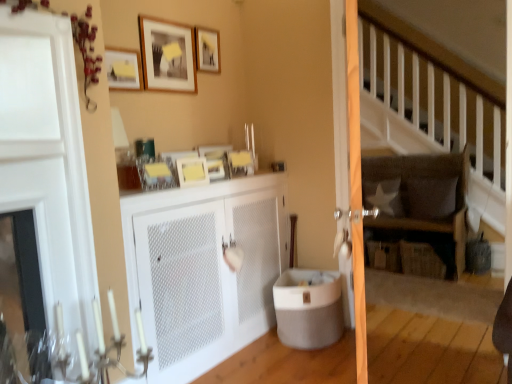
Question: Is matte yellow picture frame at upper left, the 2th picture frame in the bottom-to-top sequence, placed right next to matte yellow picture frame at upper center, positioned as the fourth picture frame in top-to-bottom order?

Choices:
 (A) no
 (B) yes

Answer: (A)

Question: Would you say matte yellow picture frame at upper left, the 2th picture frame in the bottom-to-top sequence, is outside matte yellow picture frame at upper center, arranged as the first picture frame when ordered from the bottom?

Choices:
 (A) no
 (B) yes

Answer: (B)

Question: Is matte yellow picture frame at upper left, placed as the 3th picture frame when sorted from top to bottom, taller than matte yellow picture frame at upper center, arranged as the first picture frame when ordered from the bottom?

Choices:
 (A) yes
 (B) no

Answer: (A)

Question: Does matte yellow picture frame at upper left, the 2th picture frame in the bottom-to-top sequence, appear on the right side of matte yellow picture frame at upper center, arranged as the first picture frame when ordered from the bottom?

Choices:
 (A) no
 (B) yes

Answer: (A)

Question: Is matte yellow picture frame at upper left, placed as the 3th picture frame when sorted from top to bottom, facing towards matte yellow picture frame at upper center, positioned as the fourth picture frame in top-to-bottom order?

Choices:
 (A) yes
 (B) no

Answer: (B)

Question: In terms of width, does dark brown fabric rocking chair at upper right look wider or thinner when compared to matte white screen door at center?

Choices:
 (A) wide
 (B) thin

Answer: (A)

Question: Is dark brown fabric rocking chair at upper right bigger or smaller than matte white screen door at center?

Choices:
 (A) big
 (B) small

Answer: (A)

Question: Does point (468, 163) appear closer or farther from the camera than point (352, 97)?

Choices:
 (A) farther
 (B) closer

Answer: (A)

Question: Considering their positions, is dark brown fabric rocking chair at upper right located in front of or behind matte white screen door at center?

Choices:
 (A) front
 (B) behind

Answer: (B)

Question: Is white fabric pillow at center-right, which ranks as the first pillow in left-to-right order, inside the boundaries of matte wooden picture frame at upper center, the first picture frame in the top-to-bottom sequence, or outside?

Choices:
 (A) inside
 (B) outside

Answer: (B)

Question: From the image's perspective, relative to matte wooden picture frame at upper center, the 4th picture frame in the bottom-to-top sequence, is white fabric pillow at center-right, acting as the second pillow starting from the right, above or below?

Choices:
 (A) below
 (B) above

Answer: (A)

Question: In terms of width, does white fabric pillow at center-right, acting as the second pillow starting from the right, look wider or thinner when compared to matte wooden picture frame at upper center, the 4th picture frame in the bottom-to-top sequence?

Choices:
 (A) thin
 (B) wide

Answer: (B)

Question: Looking at the image, does white fabric pillow at center-right, acting as the second pillow starting from the right, seem bigger or smaller compared to matte wooden picture frame at upper center, the 4th picture frame in the bottom-to-top sequence?

Choices:
 (A) big
 (B) small

Answer: (A)

Question: From a real-world perspective, is white mesh cabinet at center physically located above or below matte white picture frame at upper center, which is the 3th picture frame in bottom-to-top order?

Choices:
 (A) below
 (B) above

Answer: (A)

Question: In the image, is white mesh cabinet at center positioned in front of or behind matte white picture frame at upper center, which is the 3th picture frame in bottom-to-top order?

Choices:
 (A) behind
 (B) front

Answer: (B)